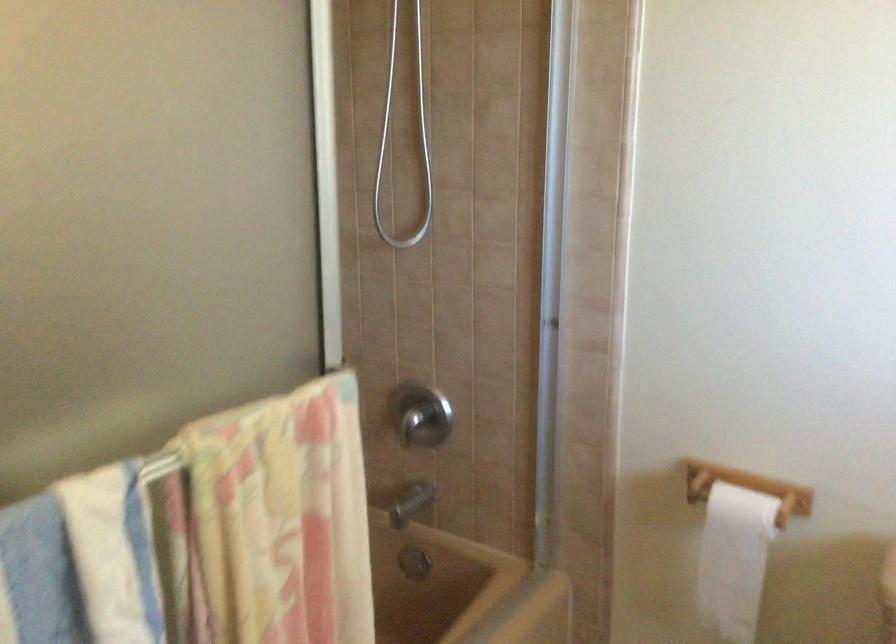
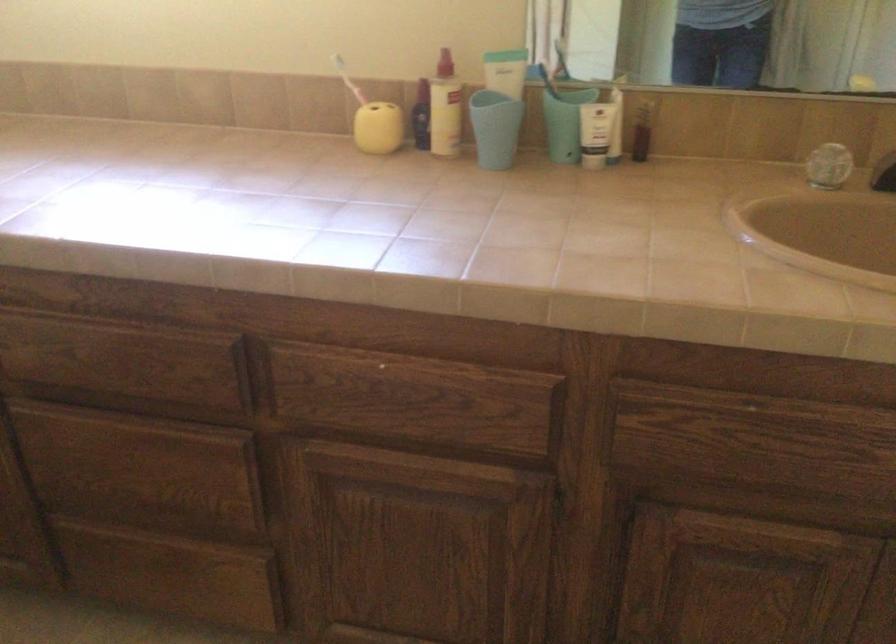
The images are taken continuously from a first-person perspective. In which direction is your viewpoint rotating?

The rotation direction of the camera is right-down.